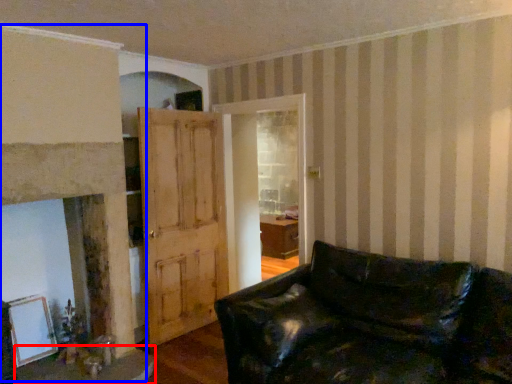
Question: Which object is further to the camera taking this photo, table (highlighted by a red box) or fireplace (highlighted by a blue box)?

Choices:
 (A) table
 (B) fireplace

Answer: (A)